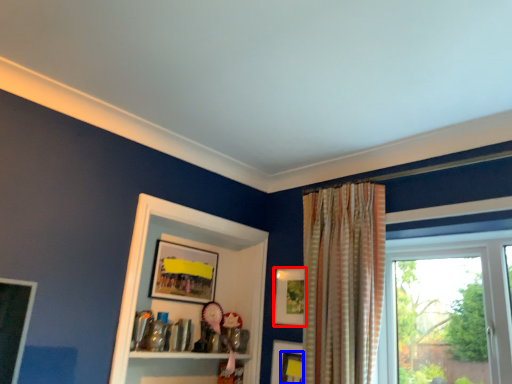
Question: Which object is closer to the camera taking this photo, picture frame (highlighted by a red box) or picture frame (highlighted by a blue box)?

Choices:
 (A) picture frame
 (B) picture frame

Answer: (B)